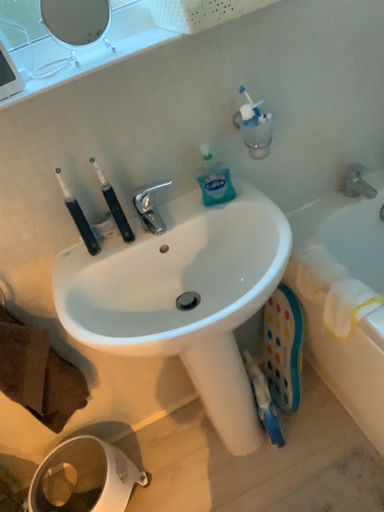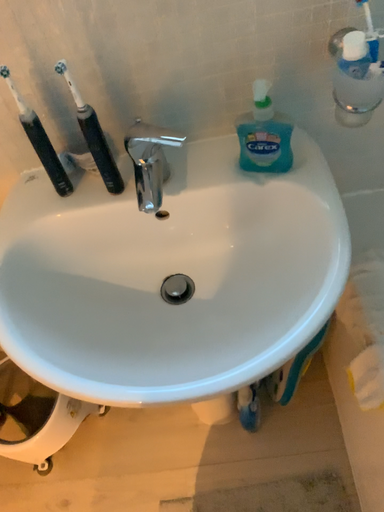
Question: How did the camera likely rotate when shooting the video?

Choices:
 (A) rotated downward
 (B) rotated upward

Answer: (A)